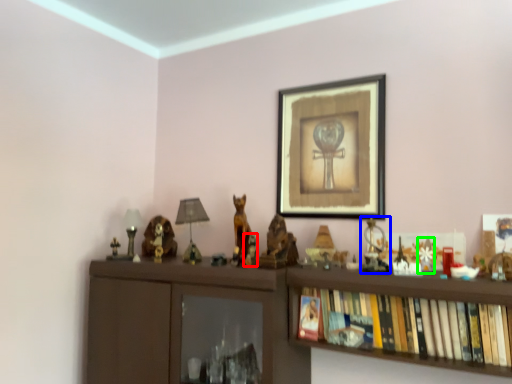
Question: Considering the real-world distances, which object is farthest from toy (highlighted by a red box)? toy (highlighted by a blue box) or toy (highlighted by a green box)?

Choices:
 (A) toy
 (B) toy

Answer: (B)